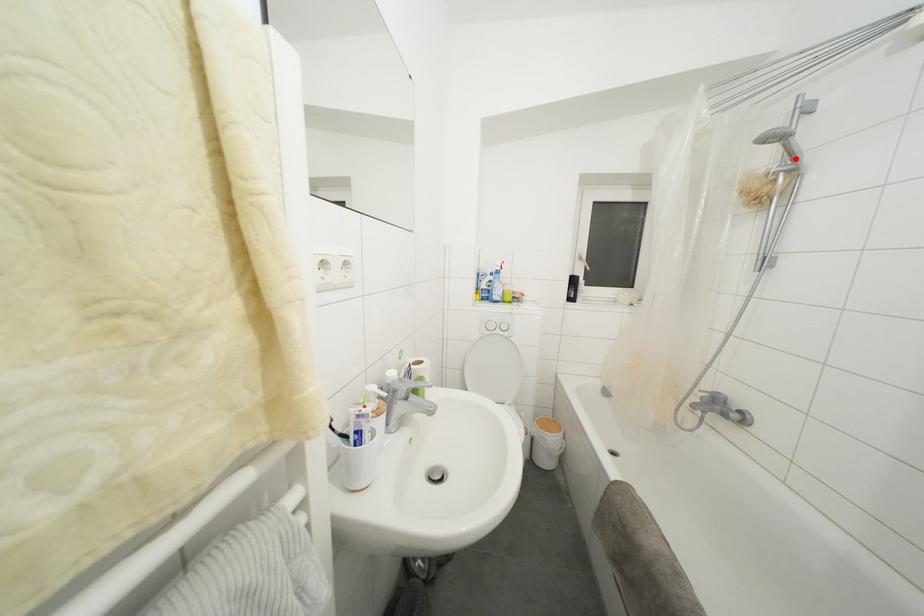
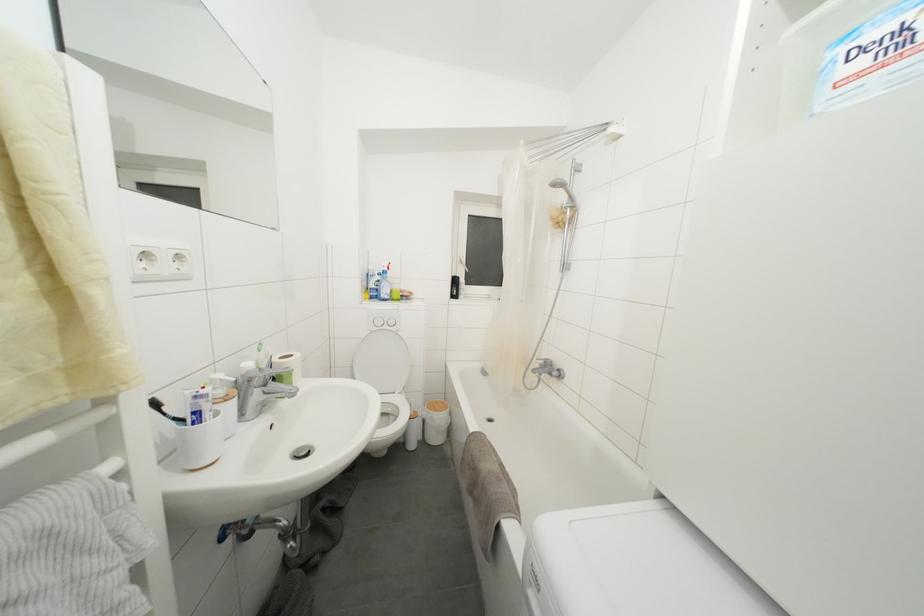
Locate, in the second image, the point that corresponds to the highlighted location in the first image.

(575, 200)